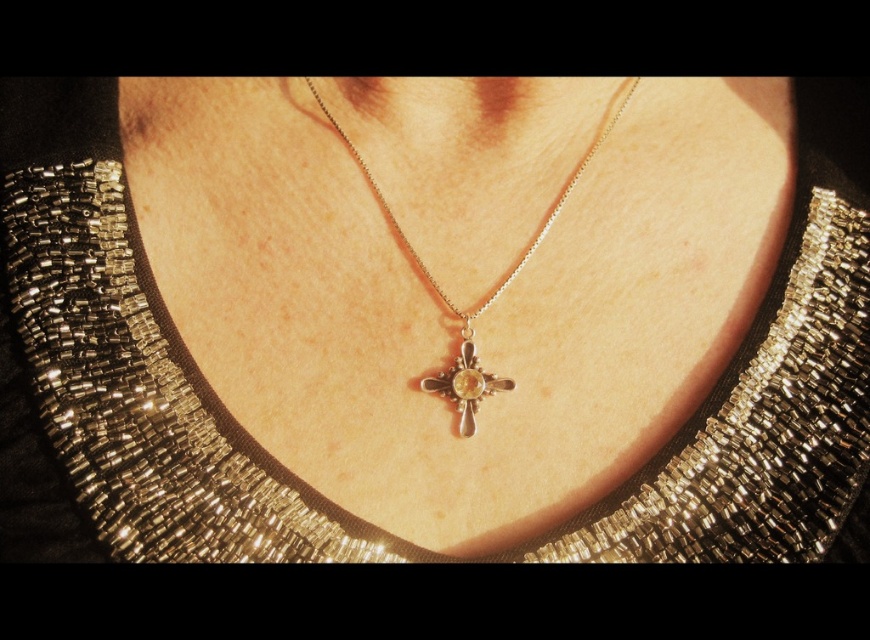
Question: Does silver/golden cross at center appear over gold metallic cross at center?

Choices:
 (A) no
 (B) yes

Answer: (B)

Question: Which point is closer to the camera?

Choices:
 (A) (464, 372)
 (B) (464, 365)

Answer: (A)

Question: Where is silver/golden cross at center located in relation to gold metallic cross at center in the image?

Choices:
 (A) right
 (B) left

Answer: (A)

Question: Which object is closer to the camera taking this photo?

Choices:
 (A) silver/golden cross at center
 (B) gold metallic cross at center

Answer: (A)

Question: Does silver/golden cross at center have a larger size compared to gold metallic cross at center?

Choices:
 (A) yes
 (B) no

Answer: (A)

Question: Which point is closer to the camera?

Choices:
 (A) (447, 385)
 (B) (454, 374)

Answer: (A)